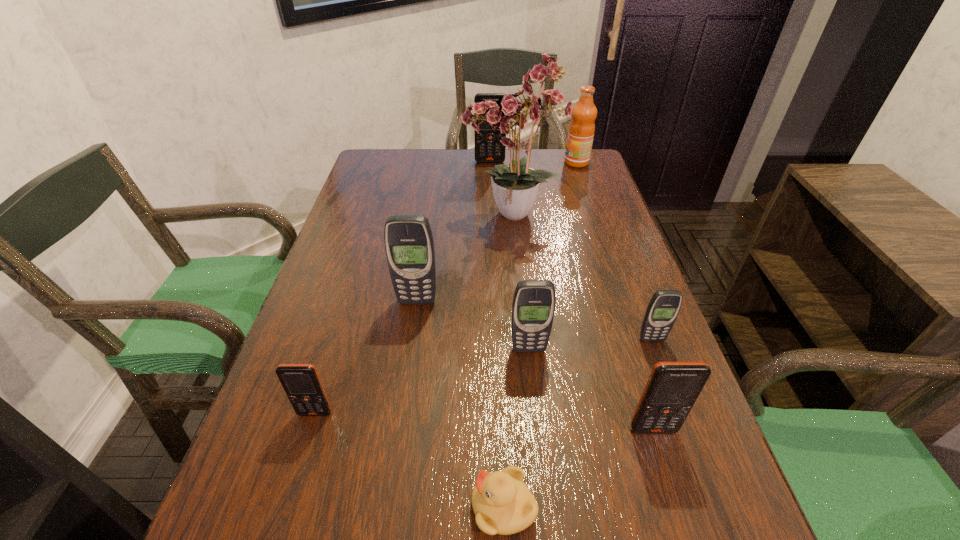
Where is `flower arrangement present at the right edge`? The height and width of the screenshot is (540, 960). flower arrangement present at the right edge is located at coordinates (515, 187).

This screenshot has width=960, height=540. Find the location of `fruit juice positioned at the right edge`. fruit juice positioned at the right edge is located at coordinates (580, 136).

You are a GUI agent. You are given a task and a screenshot of the screen. Output one action in this format:
    pyautogui.click(x=<x>, y=<y>)
    Task: Click on the object positioned at the far right corner
    This screenshot has height=540, width=960.
    Given the screenshot: What is the action you would take?
    pyautogui.click(x=580, y=136)

Where is `free space at the far edge of the desktop`? The image size is (960, 540). free space at the far edge of the desktop is located at coordinates (461, 180).

Where is `blank space at the left edge`? The image size is (960, 540). blank space at the left edge is located at coordinates (374, 214).

Where is `free space at the right edge of the desktop`? free space at the right edge of the desktop is located at coordinates (579, 188).

What are the coordinates of `free space at the far left corner` in the screenshot? It's located at (383, 152).

Find the location of a particular element. free space at the far right corner of the desktop is located at coordinates (593, 154).

What are the coordinates of `empty space that is in between the farthest gray cellular telephone and the second orange cellular telephone from right to left` in the screenshot? It's located at [x=453, y=231].

Locate an element on the screen. free space between the second nearest object and the second gray cellular telephone from right to left is located at coordinates (591, 389).